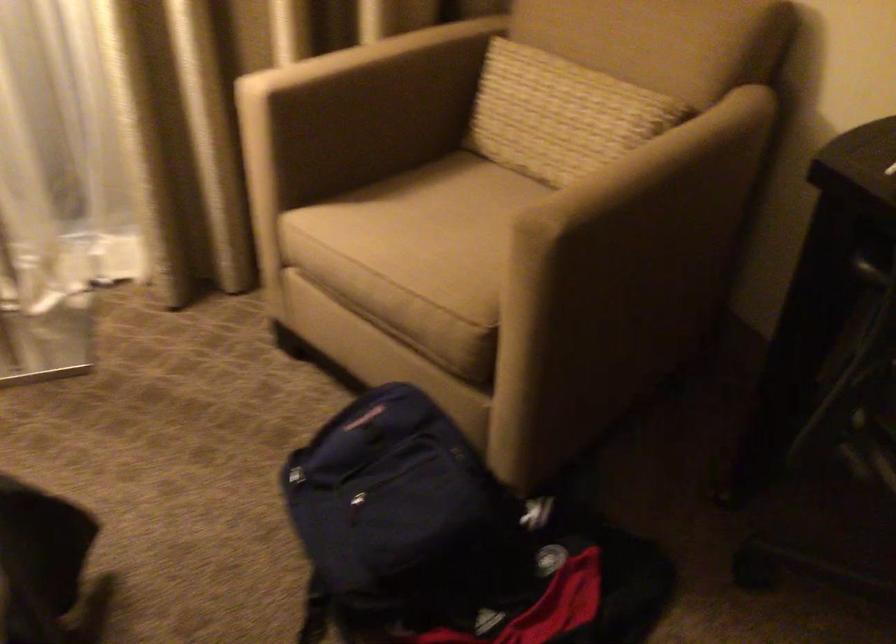
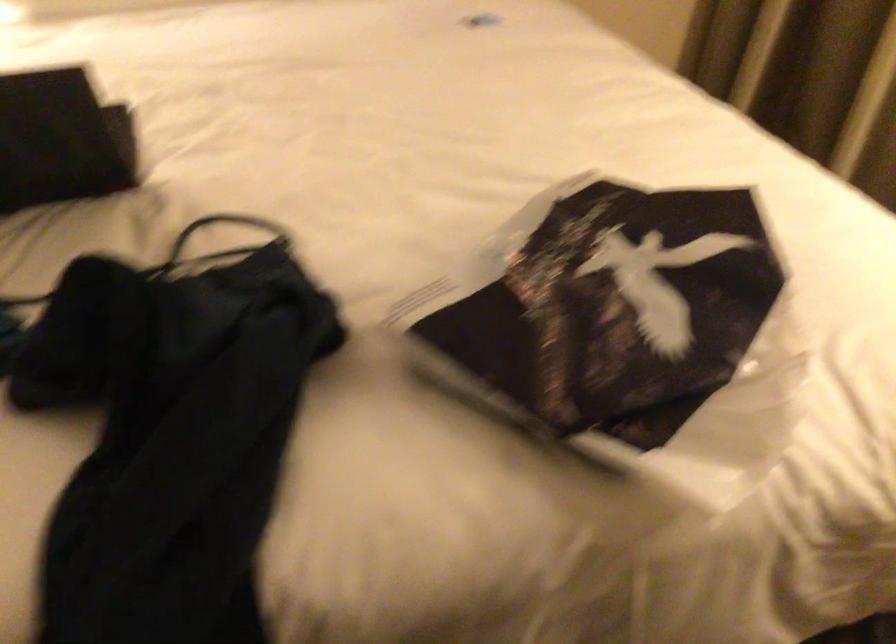
In the scene shown: The first image is from the beginning of the video and the second image is from the end. How did the camera likely rotate when shooting the video?

The camera's rotation is toward left-down.